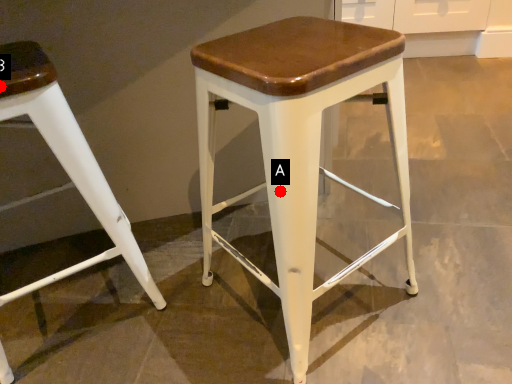
Question: Two points are circled on the image, labeled by A and B beside each circle. Which point is closer to the camera taking this photo?

Choices:
 (A) A is closer
 (B) B is closer

Answer: (A)